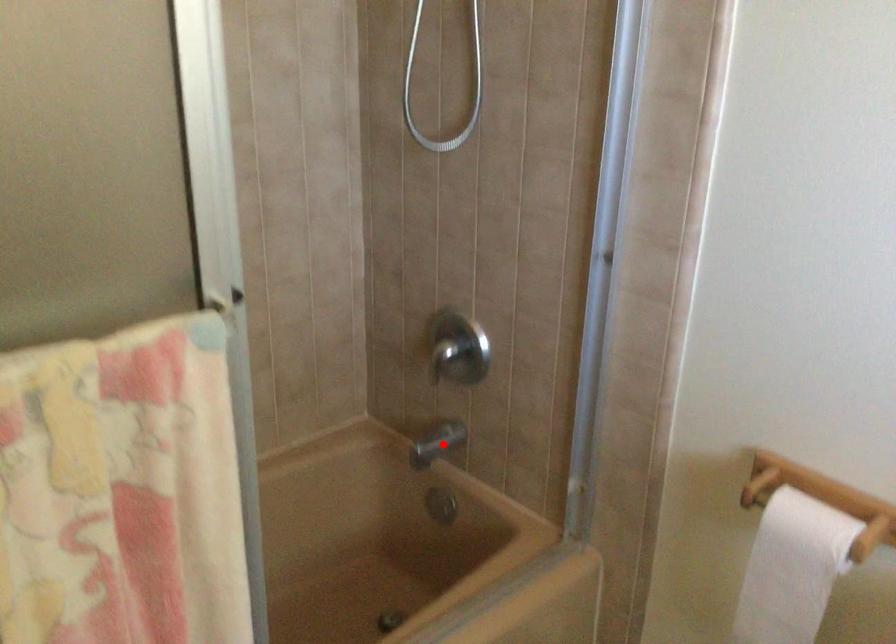
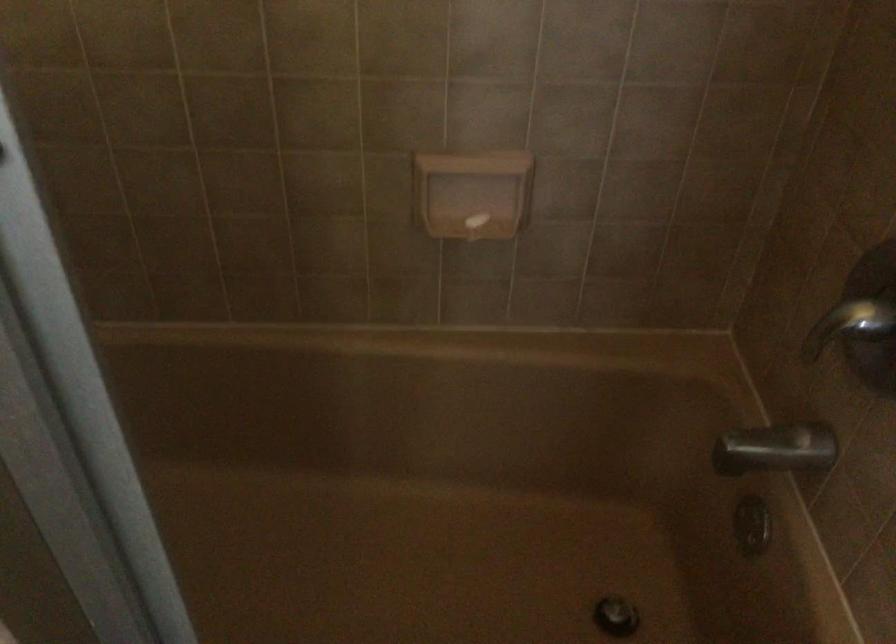
Where in the second image is the point corresponding to the highlighted location from the first image?

(776, 449)